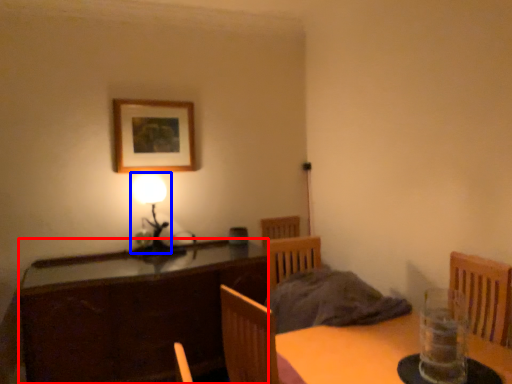
Question: Which object appears farthest to the camera in this image, cabinetry (highlighted by a red box) or table lamp (highlighted by a blue box)?

Choices:
 (A) cabinetry
 (B) table lamp

Answer: (B)